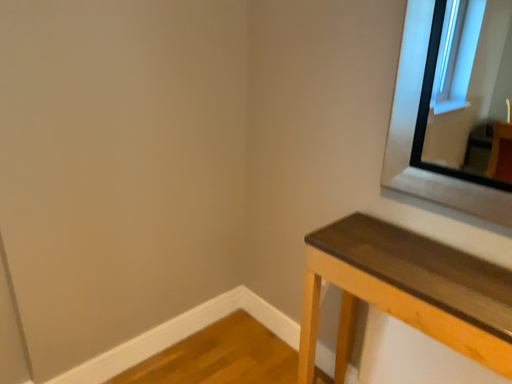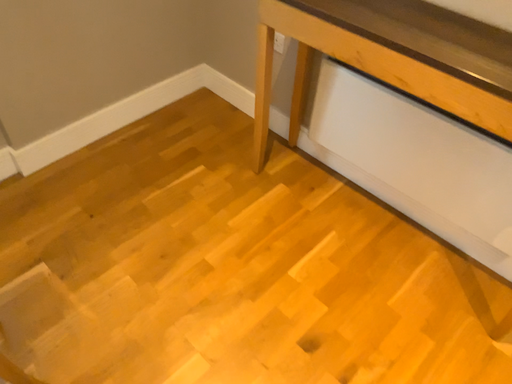
Question: How did the camera likely rotate when shooting the video?

Choices:
 (A) rotated upward
 (B) rotated downward

Answer: (B)